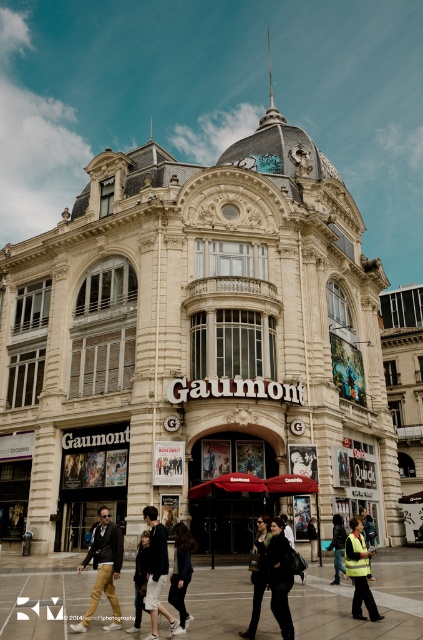
You are standing at the entrance of the Gaumont cinema facing the building. There are two points marked on the facade. The first point is at coordinates point (271, 600) and the second is at point (145, 520). Which point is closer to you?

Point (271, 600) is in front of point (145, 520), so the first point is closer to you.